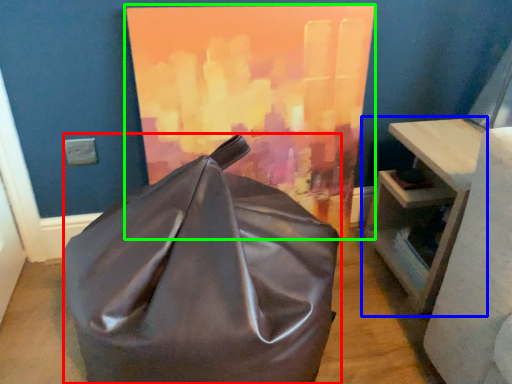
Question: Which object is positioned farthest from furniture (highlighted by a red box)? Select from table (highlighted by a blue box) and oil painting (highlighted by a green box).

Choices:
 (A) table
 (B) oil painting

Answer: (A)